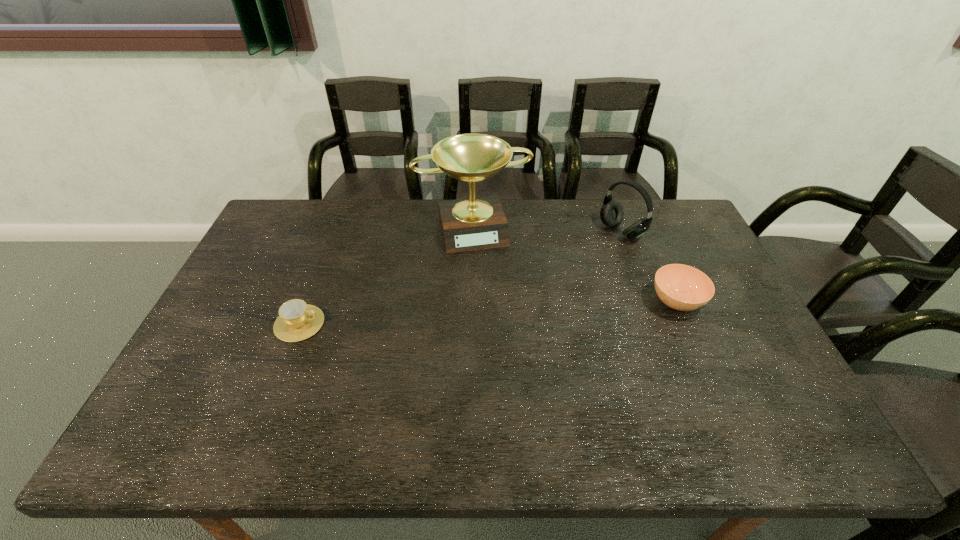
Locate an element on the screen. This screenshot has height=540, width=960. free location located on the front-facing side of the second object from left to right is located at coordinates (499, 312).

Find the location of a particular element. vacant space positioned 0.320m on the ear cups of the headset is located at coordinates (538, 281).

Identify the location of vacant space located on the ear cups of the headset. (587, 253).

This screenshot has height=540, width=960. Identify the location of free space located 0.380m on the ear cups of the headset. (522, 290).

Locate an element on the screen. The height and width of the screenshot is (540, 960). award present at the far edge is located at coordinates (475, 223).

Identify the location of headset that is at the far edge. The width and height of the screenshot is (960, 540). (611, 213).

You are a GUI agent. You are given a task and a screenshot of the screen. Output one action in this format:
    pyautogui.click(x=<x>, y=<y>)
    Task: Click on the object situated at the right edge
    This screenshot has height=540, width=960.
    Given the screenshot: What is the action you would take?
    pyautogui.click(x=681, y=287)

In the image, there is a desktop. Identify the location of vacant space at the far edge. (330, 238).

Locate an element on the screen. vacant space at the near edge of the desktop is located at coordinates (698, 387).

The image size is (960, 540). I want to click on free point at the left edge, so click(256, 330).